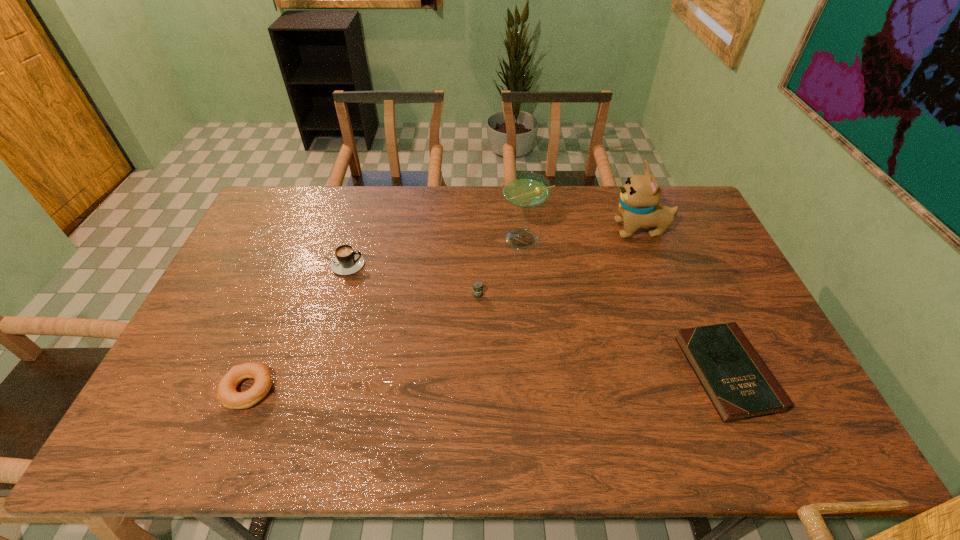
The width and height of the screenshot is (960, 540). Identify the location of vacant space that satisfies the following two spatial constraints: 1. with the handle on the side of the fourth shortest object; 2. on the back side of the shortest object. (308, 373).

This screenshot has width=960, height=540. In order to click on vacant space that satisfies the following two spatial constraints: 1. on the front side of the martini; 2. with the handle on the side of the third tallest object in this screenshot , I will do `click(526, 265)`.

What are the coordinates of `vacant space that satisfies the following two spatial constraints: 1. with the handle on the side of the fourth shortest object; 2. on the left side of the Bible` in the screenshot? It's located at (308, 373).

Locate an element on the screen. Image resolution: width=960 pixels, height=540 pixels. free space that satisfies the following two spatial constraints: 1. on the back side of the shortest object; 2. with the handle on the side of the fourth shortest object is located at coordinates (679, 265).

The width and height of the screenshot is (960, 540). Identify the location of free region that satisfies the following two spatial constraints: 1. with the handle on the side of the cappuccino; 2. on the left side of the Bible. (308, 373).

Locate an element on the screen. The width and height of the screenshot is (960, 540). vacant region that satisfies the following two spatial constraints: 1. on the face of the puppy; 2. on the back side of the Bible is located at coordinates (697, 373).